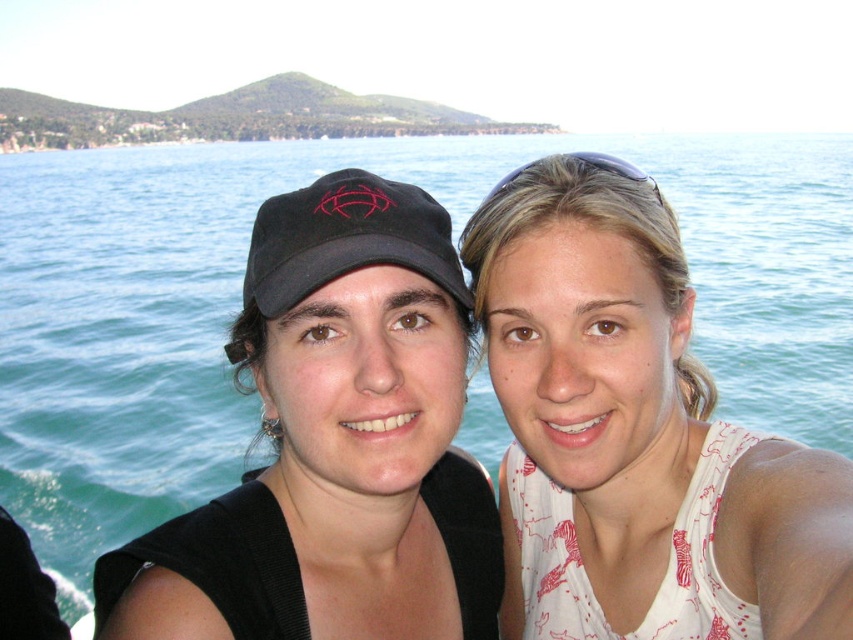
Question: Does white printed tank top at center have a lesser width compared to black matte cap at center?

Choices:
 (A) no
 (B) yes

Answer: (A)

Question: Which of the following is the closest to the observer?

Choices:
 (A) (344, 328)
 (B) (358, 195)

Answer: (B)

Question: Which point is farther from the camera taking this photo?

Choices:
 (A) (720, 486)
 (B) (286, 195)

Answer: (B)

Question: Which point appears closest to the camera in this image?

Choices:
 (A) (618, 410)
 (B) (398, 348)

Answer: (A)

Question: Can you confirm if white printed tank top at center is positioned to the left of black matte cap at center?

Choices:
 (A) yes
 (B) no

Answer: (B)

Question: Does white printed tank top at center appear over black matte cap at center?

Choices:
 (A) yes
 (B) no

Answer: (A)